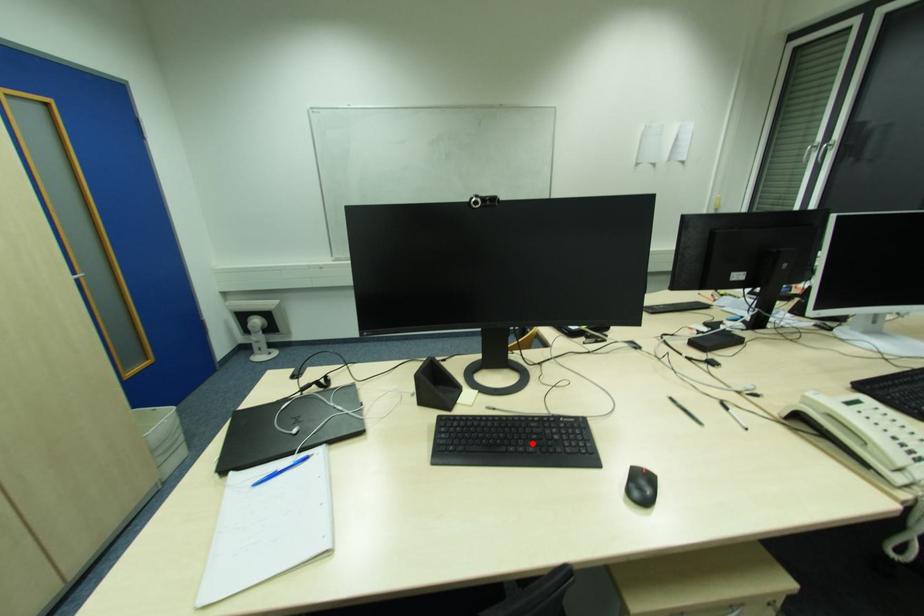
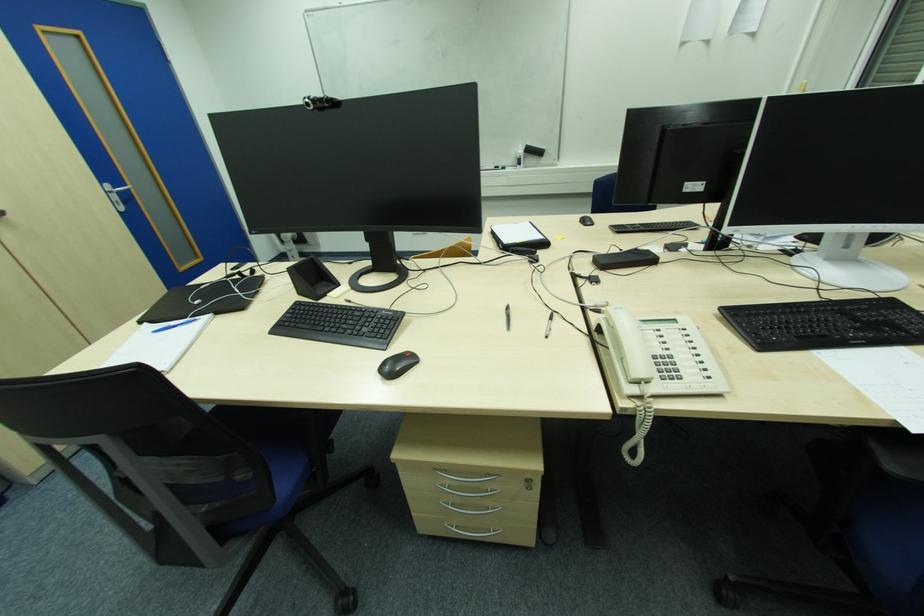
Where in the second image is the point corresponding to the highlighted location from the first image?

(346, 328)